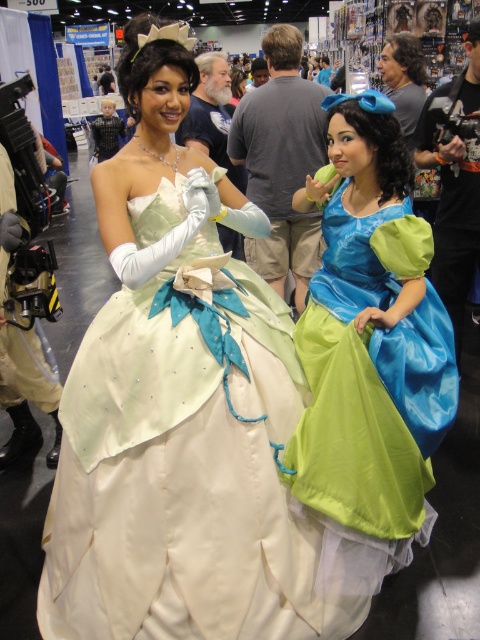
Question: Does satin white dress at center appear over matte blue-green dress at right?

Choices:
 (A) no
 (B) yes

Answer: (A)

Question: Among these points, which one is nearest to the camera?

Choices:
 (A) (180, 289)
 (B) (396, 392)

Answer: (B)

Question: Which point is farther to the camera?

Choices:
 (A) (433, 435)
 (B) (188, 433)

Answer: (A)

Question: Is satin white dress at center smaller than matte blue-green dress at right?

Choices:
 (A) yes
 (B) no

Answer: (B)

Question: From the image, what is the correct spatial relationship of satin white dress at center in relation to matte blue-green dress at right?

Choices:
 (A) left
 (B) right

Answer: (A)